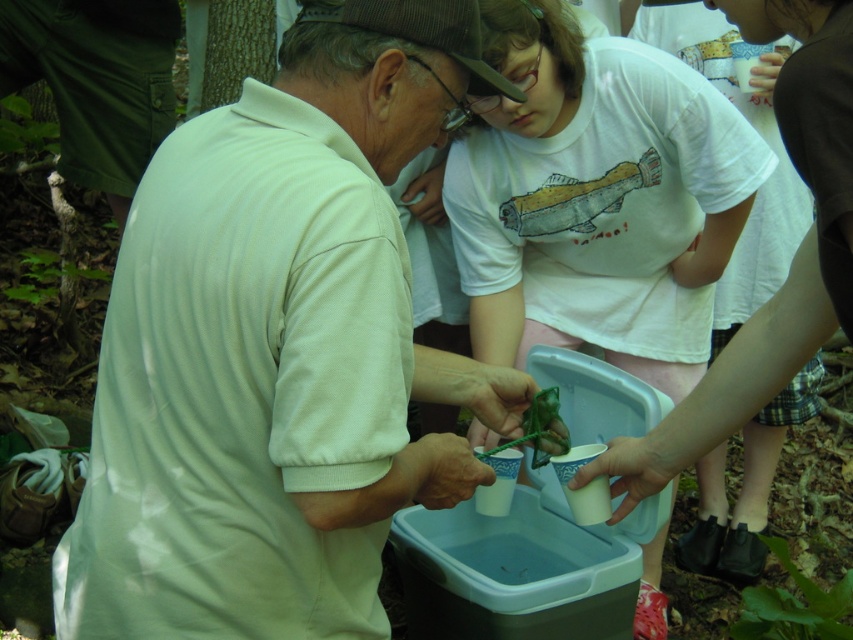
Between white matte shirt at center and green leafy plant at lower right, which one is positioned lower?

green leafy plant at lower right is lower down.

Does white matte shirt at center appear on the right side of green leafy plant at lower right?

Incorrect, white matte shirt at center is not on the right side of green leafy plant at lower right.

The height and width of the screenshot is (640, 853). What do you see at coordinates (277, 348) in the screenshot?
I see `white matte shirt at center` at bounding box center [277, 348].

Where is `white matte shirt at center`? This screenshot has height=640, width=853. white matte shirt at center is located at coordinates (277, 348).

The image size is (853, 640). What do you see at coordinates (596, 198) in the screenshot? I see `white cotton shirt at center` at bounding box center [596, 198].

Does white cotton shirt at center have a lesser width compared to green leafy plant at lower right?

No.

Identify the location of white cotton shirt at center. (596, 198).

Between white matte shirt at center and white cotton shirt at center, which one is positioned lower?

white matte shirt at center is below.

Who is positioned more to the left, white matte shirt at center or white cotton shirt at center?

white matte shirt at center is more to the left.

Identify the location of white matte shirt at center. The width and height of the screenshot is (853, 640). (277, 348).